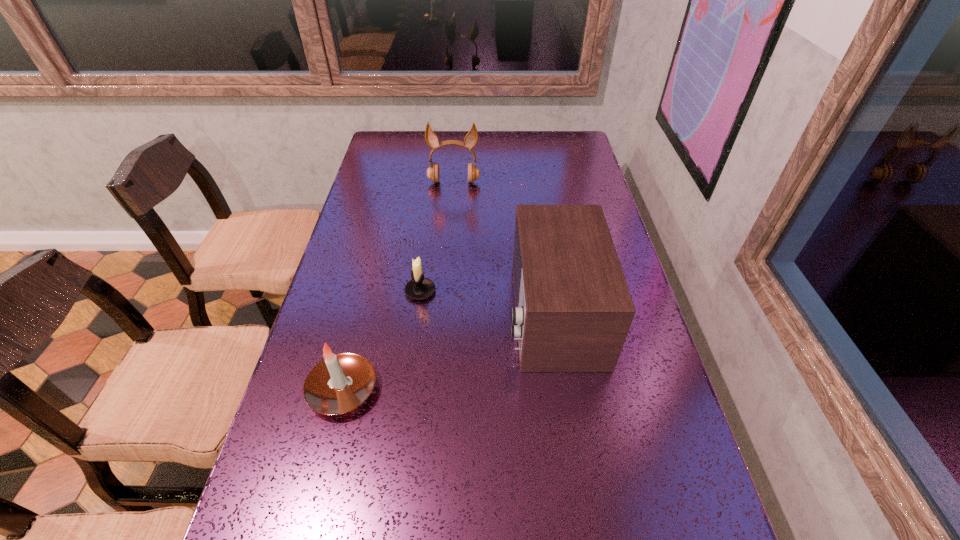
Where is `free region located 0.070m on the front of the candle holder`? free region located 0.070m on the front of the candle holder is located at coordinates (416, 323).

Locate an element on the screen. object located at the left edge is located at coordinates (339, 383).

The height and width of the screenshot is (540, 960). Find the location of `object that is at the right edge`. object that is at the right edge is located at coordinates (573, 309).

Where is `free space at the left edge`? The image size is (960, 540). free space at the left edge is located at coordinates (393, 207).

The width and height of the screenshot is (960, 540). Find the location of `free location at the right edge of the desktop`. free location at the right edge of the desktop is located at coordinates (596, 192).

At what (x,y) coordinates should I click in order to perform the action: click on vacant space at the far left corner of the desktop. Please return your answer as a coordinate pair (x, y). This screenshot has height=540, width=960. Looking at the image, I should click on (397, 148).

You are a GUI agent. You are given a task and a screenshot of the screen. Output one action in this format:
    pyautogui.click(x=<x>, y=<y>)
    Task: Click on the vacant space at the far right corner of the desktop
    The height and width of the screenshot is (540, 960).
    Given the screenshot: What is the action you would take?
    pyautogui.click(x=554, y=157)

The width and height of the screenshot is (960, 540). I want to click on free space between the rightmost object and the earphone, so click(503, 248).

Find the location of a particular element. This screenshot has width=960, height=540. free space between the rightmost object and the farthest object is located at coordinates (503, 248).

Locate an element on the screen. vacant area that lies between the candle holder and the rightmost object is located at coordinates (487, 302).